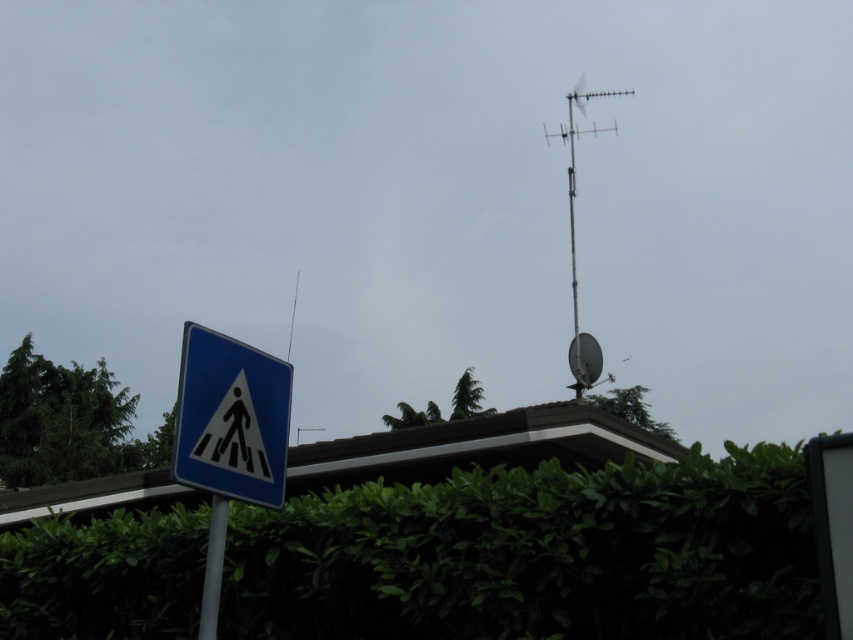
Consider the image. You are a delivery drone flying towards the building roof. You see the green leafy hedge at lower center and the metallic antenna at upper right. Which object is positioned to the left when viewed from your perspective?

The green leafy hedge at lower center is positioned to the left of the metallic antenna at upper right from the drone perspective.

You are standing at the pedestrian crossing sign in the foreground. Looking towards the background, where would you see the green leafy hedge at lower center? Please provide its 2D coordinates as a point in the format of a tuple with two decimal numbers between 0 and 1, where 0 is the bottom and left edges, and 1 is the top and right edges of the image.

The green leafy hedge at lower center is located at coordinates point (537, 556).

Looking at this image, you are a city planner assessing the visibility of the pedestrian crossing sign. The sign is mounted on a white pole. You notice the green leafy hedge at lower center and the metallic antenna at upper right. Which object might block the view of the sign more due to its width?

The metallic antenna at upper right is wider than the green leafy hedge at lower center, so it might block the view of the sign more due to its greater width.